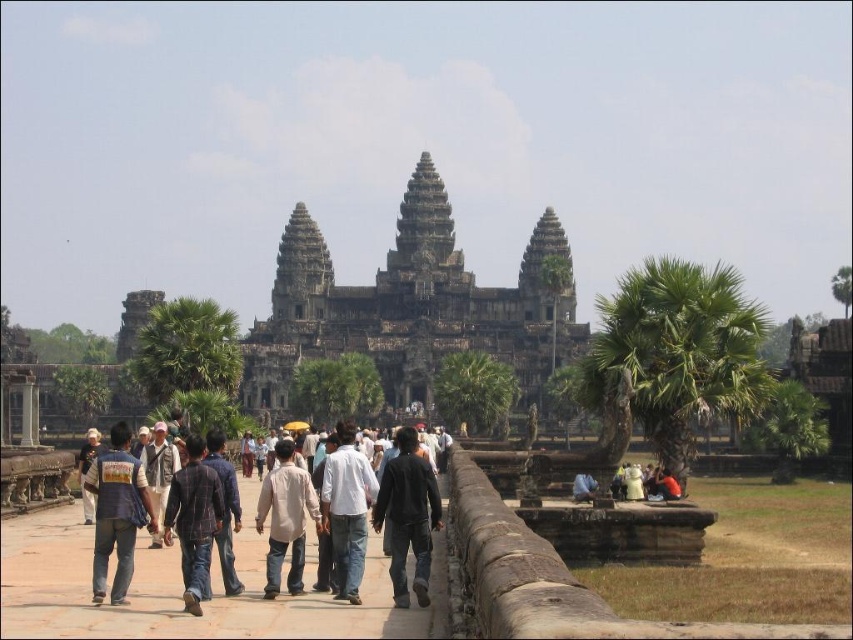
Between point (204, 492) and point (289, 480), which one is positioned behind?

The point (289, 480) is behind.

Between plaid shirt at center and light brown cotton shirt at center, which one has more height?

plaid shirt at center is taller.

Which is behind, point (200, 595) or point (268, 538)?

Point (268, 538)

Locate an element on the screen. plaid shirt at center is located at coordinates (194, 520).

From the picture: Does denim jacket at lower left have a smaller size compared to light brown cotton shirt at center?

No, denim jacket at lower left is not smaller than light brown cotton shirt at center.

Locate an element on the screen. The height and width of the screenshot is (640, 853). denim jacket at lower left is located at coordinates tap(117, 513).

At what (x,y) coordinates should I click in order to perform the action: click on denim jacket at lower left. Please return your answer as a coordinate pair (x, y). The image size is (853, 640). Looking at the image, I should click on (117, 513).

Who is shorter, dark gray stone hindu temple at center or plaid shirt at center?

Standing shorter between the two is plaid shirt at center.

Is dark gray stone hindu temple at center bigger than plaid shirt at center?

Yes, dark gray stone hindu temple at center is bigger than plaid shirt at center.

Who is more distant from viewer, (434, 321) or (219, 486)?

The point (434, 321) is more distant.

Identify the location of dark gray stone hindu temple at center. (410, 307).